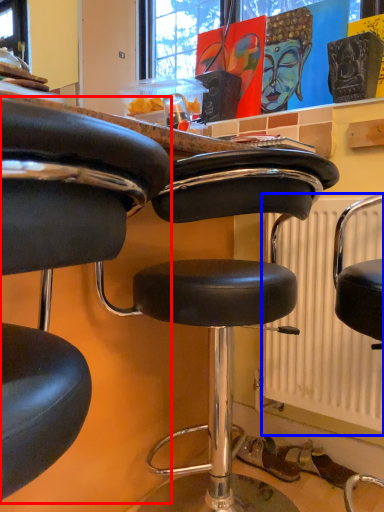
Question: Which point is closer to the camera, chair (highlighted by a red box) or radiator (highlighted by a blue box)?

Choices:
 (A) chair
 (B) radiator

Answer: (A)